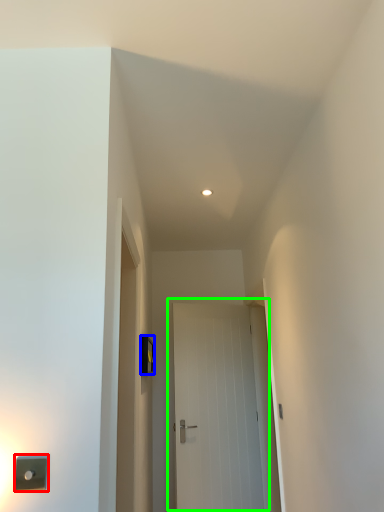
Question: Which object is the farthest from light switch (highlighted by a red box)? Choose among these: light switch (highlighted by a blue box) or door (highlighted by a green box).

Choices:
 (A) light switch
 (B) door

Answer: (B)